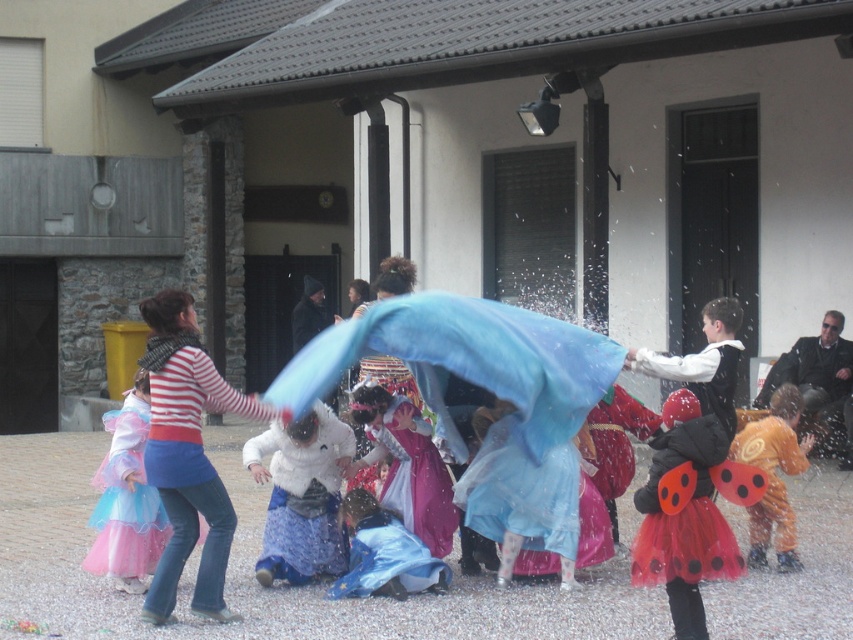
Question: Which of the following is the closest to the observer?

Choices:
 (A) blue tulle skirt at lower center
 (B) orange fabric costume at center

Answer: (B)

Question: Which object is positioned farthest from the blue fabric at center?

Choices:
 (A) blue tulle skirt at lower center
 (B) red tulle skirt at lower right

Answer: (B)

Question: Does red tulle skirt at lower right appear under blue tulle skirt at lower center?

Choices:
 (A) no
 (B) yes

Answer: (A)

Question: Is striped cotton shirt at center below white fluffy costume at center?

Choices:
 (A) no
 (B) yes

Answer: (A)

Question: Which of the following is the closest to the observer?

Choices:
 (A) (x=148, y=552)
 (B) (x=795, y=467)
 (C) (x=178, y=541)
 (D) (x=369, y=333)

Answer: (D)

Question: Is red tulle skirt at lower right further to camera compared to orange fabric costume at center?

Choices:
 (A) yes
 (B) no

Answer: (B)